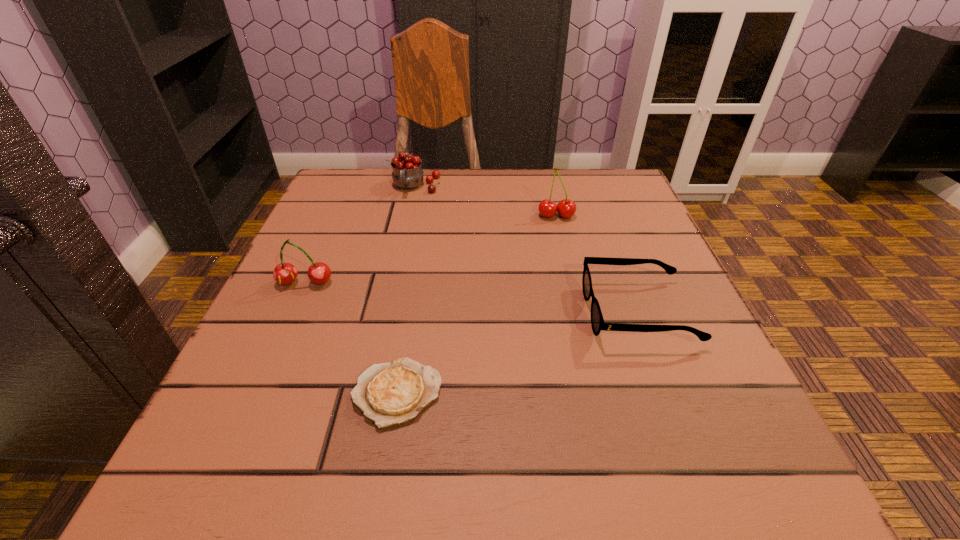
In the image, there is a desktop. At what (x,y) coordinates should I click in order to perform the action: click on vacant area at the far edge. Please return your answer as a coordinate pair (x, y). The image size is (960, 540). Looking at the image, I should click on (476, 214).

Identify the location of vacant space at the near edge of the desktop. The width and height of the screenshot is (960, 540). (469, 441).

At what (x,y) coordinates should I click in order to perform the action: click on vacant space at the left edge. Please return your answer as a coordinate pair (x, y). Looking at the image, I should click on (311, 283).

Locate an element on the screen. The width and height of the screenshot is (960, 540). vacant area at the far left corner is located at coordinates 389,177.

In the image, there is a desktop. Where is `vacant space at the near left corner`? This screenshot has width=960, height=540. vacant space at the near left corner is located at coordinates (206, 457).

The image size is (960, 540). In the image, there is a desktop. Find the location of `vacant space at the far right corner`. vacant space at the far right corner is located at coordinates (564, 173).

The image size is (960, 540). Find the location of `free point between the spectacles and the nearest object`. free point between the spectacles and the nearest object is located at coordinates (517, 353).

Image resolution: width=960 pixels, height=540 pixels. Find the location of `vacant area that lies between the second shortest object and the second nearest cherry`. vacant area that lies between the second shortest object and the second nearest cherry is located at coordinates (597, 264).

Identify the location of free space that is in between the spectacles and the second farthest cherry. (597, 264).

Identify the location of free space between the second nearest cherry and the quiche. (476, 304).